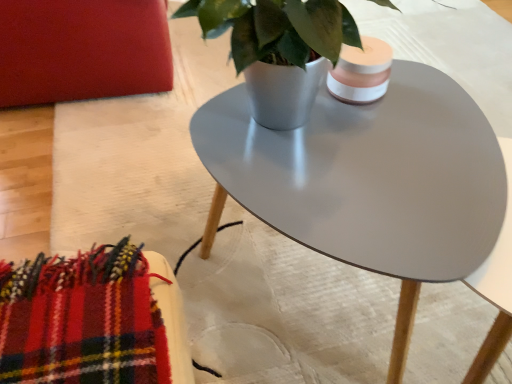
Describe the element at coordinates (368, 182) in the screenshot. I see `matte gray coffee table at center` at that location.

Locate an element on the screen. matte red armchair at upper left is located at coordinates (82, 50).

Locate an element on the screen. matte gray coffee table at center is located at coordinates (368, 182).

Between matte gray coffee table at center and matte red armchair at upper left, which one is positioned in front?

matte gray coffee table at center is in front.

How many degrees apart are the facing directions of matte gray coffee table at center and matte red armchair at upper left?

matte gray coffee table at center and matte red armchair at upper left are facing 92 degrees away from each other.

Could matte red armchair at upper left be considered to be inside matte gray coffee table at center?

Actually, matte red armchair at upper left is outside matte gray coffee table at center.

In terms of width, does matte gray coffee table at center look wider or thinner when compared to matte red armchair at upper left?

Considering their sizes, matte gray coffee table at center looks slimmer than matte red armchair at upper left.

Considering the relative positions of matte gray pot at center and matte red armchair at upper left in the image provided, is matte gray pot at center to the left of matte red armchair at upper left from the viewer's perspective?

No, matte gray pot at center is not to the left of matte red armchair at upper left.

Is matte gray pot at center wider than matte red armchair at upper left?

No.

Choose the correct answer: Is matte gray pot at center inside matte red armchair at upper left or outside it?

matte gray pot at center is located beyond the bounds of matte red armchair at upper left.

From the image's perspective, is matte gray pot at center above or below matte red armchair at upper left?

Based on their image positions, matte gray pot at center is located beneath matte red armchair at upper left.

From the image's perspective, which one is positioned higher, matte gray coffee table at center or matte gray pot at center?

matte gray pot at center.

In terms of size, does matte gray coffee table at center appear bigger or smaller than matte gray pot at center?

Considering their sizes, matte gray coffee table at center takes up more space than matte gray pot at center.

Could you tell me if matte gray coffee table at center is turned towards matte gray pot at center?

No.

Which is correct: matte red armchair at upper left is inside matte gray coffee table at center, or outside of it?

matte red armchair at upper left is not inside matte gray coffee table at center, it's outside.

In the image, there is a matte red armchair at upper left. Where is `coffee table below it (from the image's perspective)`? coffee table below it (from the image's perspective) is located at coordinates (368, 182).

Considering the sizes of objects matte red armchair at upper left and matte gray coffee table at center in the image provided, who is taller, matte red armchair at upper left or matte gray coffee table at center?

matte gray coffee table at center is taller.

Considering the relative sizes of matte red armchair at upper left and matte gray coffee table at center in the image provided, is matte red armchair at upper left smaller than matte gray coffee table at center?

Actually, matte red armchair at upper left might be larger than matte gray coffee table at center.

How many degrees apart are the facing directions of matte red armchair at upper left and matte gray pot at center?

The facing directions of matte red armchair at upper left and matte gray pot at center are 3.71 degrees apart.

Looking at this image, is matte red armchair at upper left placed right next to matte gray pot at center?

They are not placed beside each other.

From a real-world perspective, who is located lower, matte red armchair at upper left or matte gray pot at center?

matte red armchair at upper left is physically lower.

This screenshot has width=512, height=384. I want to click on houseplant below the matte red armchair at upper left (from the image's perspective), so [x=279, y=49].

Between matte gray pot at center and matte gray coffee table at center, which one has larger size?

Bigger between the two is matte gray coffee table at center.

From a real-world perspective, which object rests below the other?

In real-world perspective, matte gray coffee table at center is lower.

Considering the positions of objects matte gray pot at center and matte gray coffee table at center in the image provided, who is in front, matte gray pot at center or matte gray coffee table at center?

matte gray pot at center is closer to the camera.

Does matte gray pot at center have a lesser width compared to matte gray coffee table at center?

Correct, the width of matte gray pot at center is less than that of matte gray coffee table at center.

Identify the location of armchair on the left of matte gray coffee table at center. The height and width of the screenshot is (384, 512). (82, 50).

At what (x,y) coordinates should I click in order to perform the action: click on houseplant that is above the matte red armchair at upper left (from a real-world perspective). Please return your answer as a coordinate pair (x, y). The height and width of the screenshot is (384, 512). Looking at the image, I should click on (279, 49).

Looking at the image, which one is located closer to matte gray coffee table at center, matte gray pot at center or matte red armchair at upper left?

matte gray pot at center is closer to matte gray coffee table at center.

Estimate the real-world distances between objects in this image. Which object is closer to matte red armchair at upper left, matte gray coffee table at center or matte gray pot at center?

matte gray pot at center is closer to matte red armchair at upper left.

From the image, which object appears to be nearer to matte gray pot at center, matte gray coffee table at center or matte red armchair at upper left?

matte gray coffee table at center is positioned closer to the anchor matte gray pot at center.

Based on their spatial positions, is matte red armchair at upper left or matte gray pot at center further from matte gray coffee table at center?

matte red armchair at upper left.

Estimate the real-world distances between objects in this image. Which object is closer to matte red armchair at upper left, matte gray pot at center or matte gray coffee table at center?

The object closer to matte red armchair at upper left is matte gray pot at center.

Which object lies nearer to the anchor point matte gray pot at center, matte red armchair at upper left or matte gray coffee table at center?

matte gray coffee table at center.

Locate an element on the screen. Image resolution: width=512 pixels, height=384 pixels. houseplant situated between matte red armchair at upper left and matte gray coffee table at center from left to right is located at coordinates (279, 49).